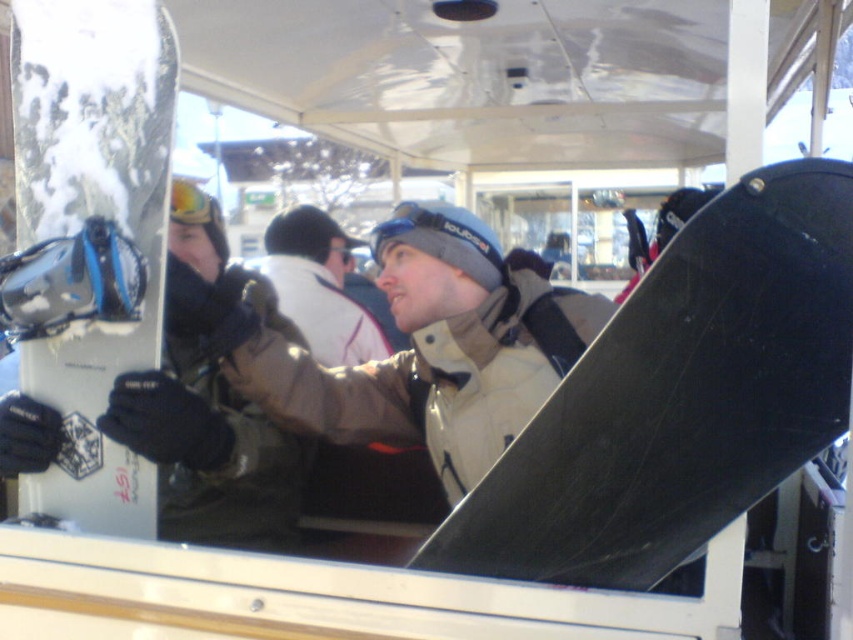
Does white matte snowboard at left have a lesser width compared to matte beige jacket at center?

Yes, white matte snowboard at left is thinner than matte beige jacket at center.

Is white matte snowboard at left smaller than matte beige jacket at center?

Correct, white matte snowboard at left occupies less space than matte beige jacket at center.

The image size is (853, 640). I want to click on white matte snowboard at left, so click(90, 237).

Does white matte snowboard at left come in front of white fleece jacket at center?

Yes, white matte snowboard at left is in front of white fleece jacket at center.

How far apart are white matte snowboard at left and white fleece jacket at center?

1.43 meters

Which is behind, point (149, 260) or point (286, 275)?

Positioned behind is point (286, 275).

This screenshot has height=640, width=853. In order to click on white matte snowboard at left in this screenshot , I will do `click(90, 237)`.

Does matte beige jacket at center appear on the left side of matte black snowboard at left?

In fact, matte beige jacket at center is to the right of matte black snowboard at left.

Does point (532, 291) lie behind point (228, 396)?

No, it is in front of (228, 396).

Which is behind, point (561, 304) or point (234, 497)?

The point (234, 497) is more distant.

Where is `matte beige jacket at center`? The width and height of the screenshot is (853, 640). matte beige jacket at center is located at coordinates (421, 346).